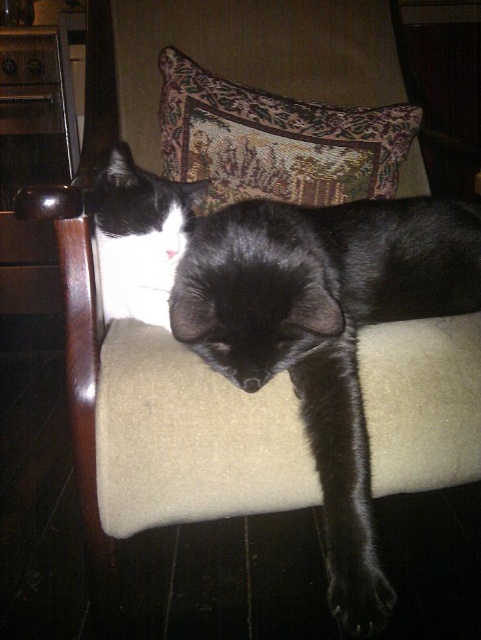
Between black fur cat at center and black matte paw at lower center, which one is positioned higher?

black fur cat at center is above.

Is black fur cat at center positioned behind black matte paw at lower center?

Yes, it is behind black matte paw at lower center.

Measure the distance between point (x=350, y=385) and camera.

Point (x=350, y=385) and camera are 77.96 centimeters apart.

Find the location of a particular element. Image resolution: width=481 pixels, height=640 pixels. black fur cat at center is located at coordinates (323, 316).

Who is more distant from viewer, (313,352) or (149,244)?

Positioned behind is point (149,244).

Is point (263, 204) farther from viewer compared to point (172, 259)?

No, it is not.

At what (x,y) coordinates should I click in order to perform the action: click on black fur cat at center. Please return your answer as a coordinate pair (x, y). This screenshot has width=481, height=640. Looking at the image, I should click on (323, 316).

Does white fur/black fur cat at upper left have a larger size compared to black matte paw at lower center?

Yes, white fur/black fur cat at upper left is bigger than black matte paw at lower center.

Who is lower down, white fur/black fur cat at upper left or black matte paw at lower center?

black matte paw at lower center is below.

Is point (155, 225) positioned before point (341, 611)?

No.

The width and height of the screenshot is (481, 640). What are the coordinates of `white fur/black fur cat at upper left` in the screenshot? It's located at tap(139, 236).